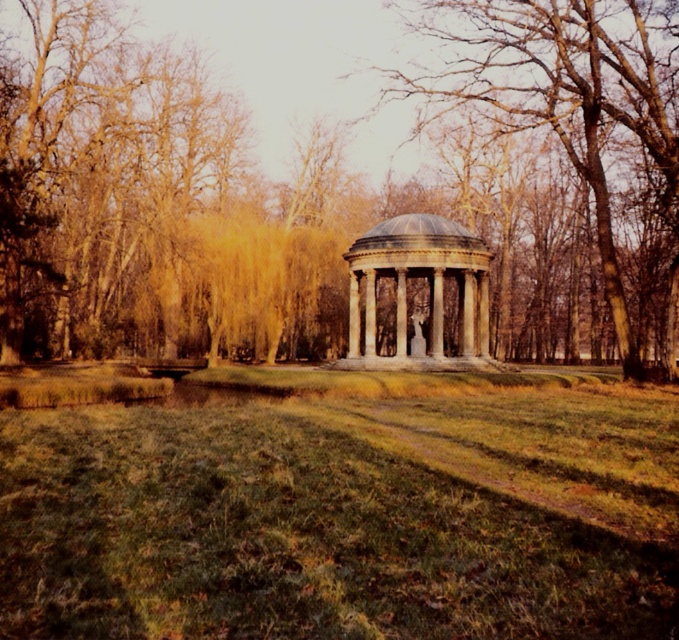
Measure the distance between point (667, 100) and camera.

Point (667, 100) and camera are 63.00 meters apart.

Is point (629, 136) positioned in front of point (253, 554)?

No, it is behind (253, 554).

Identify the location of brown wood tree at center. This screenshot has height=640, width=679. (346, 196).

Is point (251, 568) in front of point (350, 356)?

Yes, it is in front of point (350, 356).

Which is in front, point (265, 468) or point (356, 241)?

Positioned in front is point (265, 468).

Find the location of `green grassy field at center`. green grassy field at center is located at coordinates (344, 509).

You are a GUI agent. You are given a task and a screenshot of the screen. Output one action in this format:
    pyautogui.click(x=<x>, y=<y>)
    Task: Click on the green grassy field at center
    This screenshot has width=679, height=640.
    Given the screenshot: What is the action you would take?
    pyautogui.click(x=344, y=509)

Is green grassy field at center shorter than smooth gray stone gazebo at center?

Yes, green grassy field at center is shorter than smooth gray stone gazebo at center.

Does green grassy field at center lie in front of smooth gray stone gazebo at center?

Yes, it is.

Between point (509, 513) and point (591, 152), which one is positioned in front?

Point (509, 513)

The height and width of the screenshot is (640, 679). Identify the location of green grassy field at center. tap(344, 509).